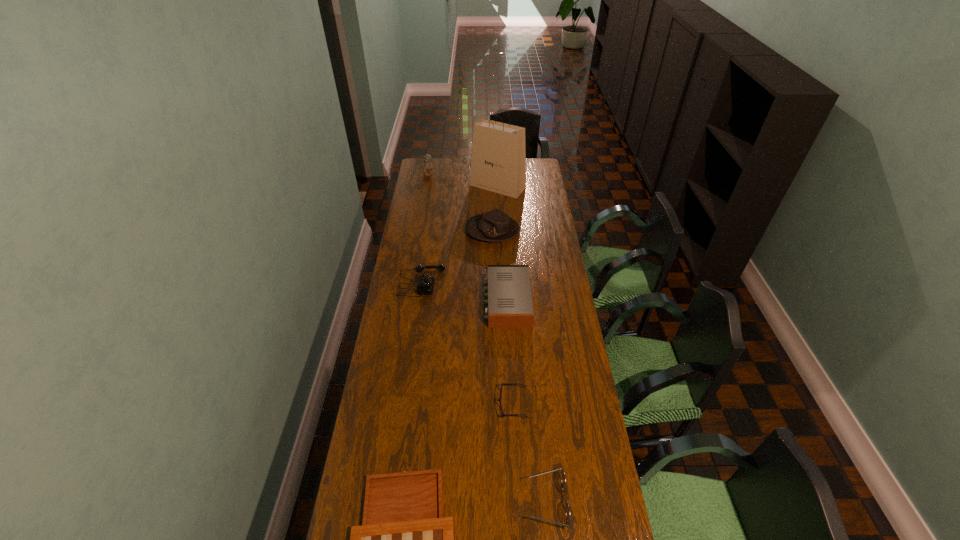
Image resolution: width=960 pixels, height=540 pixels. In order to click on free space located on the front of the shopping bag in this screenshot , I will do `click(499, 213)`.

This screenshot has width=960, height=540. I want to click on free space located on the front-facing side of the seventh shortest object, so click(x=424, y=202).

At what (x,y) coordinates should I click in order to perform the action: click on vacant area located 0.150m on the decorative side of the sixth nearest object. Please return your answer as a coordinate pair (x, y). This screenshot has height=540, width=960. Looking at the image, I should click on (435, 231).

Where is `free region located 0.240m on the decorative side of the sixth nearest object`? free region located 0.240m on the decorative side of the sixth nearest object is located at coordinates (417, 231).

The image size is (960, 540). I want to click on free spot located on the decorative side of the sixth nearest object, so click(x=428, y=231).

The height and width of the screenshot is (540, 960). Identify the location of free space located on the dial of the telephone. (507, 282).

Where is `free region located 0.120m on the control panel of the radio receiver`? Image resolution: width=960 pixels, height=540 pixels. free region located 0.120m on the control panel of the radio receiver is located at coordinates (455, 301).

Where is `free space located on the control panel of the radio receiver`? free space located on the control panel of the radio receiver is located at coordinates (433, 301).

Image resolution: width=960 pixels, height=540 pixels. In order to click on free spot located on the control panel of the radio receiver in this screenshot , I will do `click(445, 301)`.

Where is `vacant space situated 0.270m on the front-facing side of the taller spectacles`? The height and width of the screenshot is (540, 960). vacant space situated 0.270m on the front-facing side of the taller spectacles is located at coordinates (432, 501).